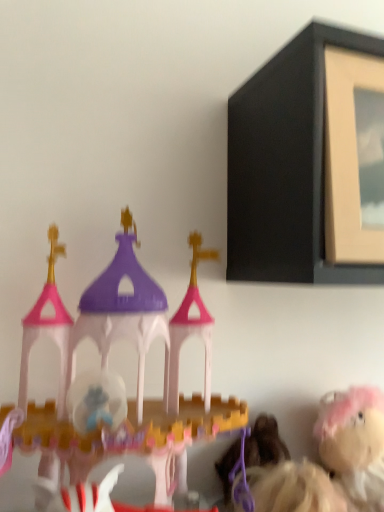
Question: Are matte black picture frame at upper right and matte plastic castle at left, arranged as the 1th toy when viewed from the left, making contact?

Choices:
 (A) yes
 (B) no

Answer: (B)

Question: Would you say matte plastic castle at left, arranged as the 1th toy when viewed from the left, is part of matte black picture frame at upper right's contents?

Choices:
 (A) yes
 (B) no

Answer: (B)

Question: Considering the relative sizes of matte black picture frame at upper right and matte plastic castle at left, arranged as the 1th toy when viewed from the left, in the image provided, is matte black picture frame at upper right bigger than matte plastic castle at left, arranged as the 1th toy when viewed from the left,?

Choices:
 (A) yes
 (B) no

Answer: (A)

Question: Would you say matte black picture frame at upper right is a long distance from matte plastic castle at left, arranged as the 2th toy when viewed from the back?

Choices:
 (A) no
 (B) yes

Answer: (A)

Question: Is matte black picture frame at upper right aimed at matte plastic castle at left, the 2th toy from the right?

Choices:
 (A) no
 (B) yes

Answer: (A)

Question: Considering the positions of point (119, 335) and point (349, 406), is point (119, 335) closer or farther from the camera than point (349, 406)?

Choices:
 (A) closer
 (B) farther

Answer: (A)

Question: Looking at the image, does matte plastic castle at left, arranged as the 2th toy when viewed from the back, seem bigger or smaller compared to fluffy pink plush at lower right, the first toy viewed from the right?

Choices:
 (A) big
 (B) small

Answer: (A)

Question: Relative to fluffy pink plush at lower right, which is the 2th toy in left-to-right order, is matte plastic castle at left, the 2th toy from the right, in front or behind?

Choices:
 (A) behind
 (B) front

Answer: (B)

Question: Would you say matte plastic castle at left, the 2th toy from the right, is inside or outside fluffy pink plush at lower right, which is the 2th toy from front to back?

Choices:
 (A) inside
 (B) outside

Answer: (B)

Question: Looking at their shapes, would you say fluffy pink plush at lower right, which is the 2th toy from front to back, is wider or thinner than matte plastic castle at left, the 2th toy from the right?

Choices:
 (A) thin
 (B) wide

Answer: (A)

Question: Is point (365, 450) closer or farther from the camera than point (16, 432)?

Choices:
 (A) closer
 (B) farther

Answer: (B)

Question: Would you say fluffy pink plush at lower right, the 1th toy positioned from the back, is inside or outside matte plastic castle at left, arranged as the 1th toy when viewed from the left?

Choices:
 (A) inside
 (B) outside

Answer: (B)

Question: Considering their positions, is fluffy pink plush at lower right, which is the 2th toy in left-to-right order, located in front of or behind matte plastic castle at left, arranged as the 1th toy when viewed from the left?

Choices:
 (A) front
 (B) behind

Answer: (B)

Question: Which is correct: matte plastic castle at left, arranged as the 1th toy when viewed from the left, is inside matte black picture frame at upper right, or outside of it?

Choices:
 (A) inside
 (B) outside

Answer: (B)

Question: Is point (59, 353) positioned closer to the camera than point (360, 274)?

Choices:
 (A) closer
 (B) farther

Answer: (B)